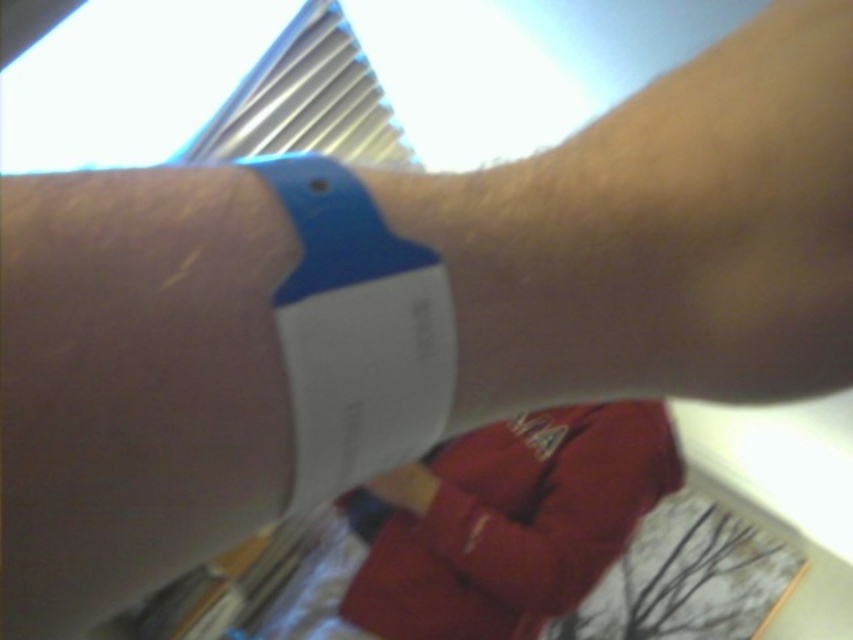
Question: Is white plastic wristband at center wider than matte plastic wristband at center?

Choices:
 (A) yes
 (B) no

Answer: (B)

Question: Does matte red jacket at center appear on the left side of matte plastic wristband at center?

Choices:
 (A) yes
 (B) no

Answer: (B)

Question: Is matte red jacket at center further to camera compared to blue rubber wristband at center?

Choices:
 (A) yes
 (B) no

Answer: (A)

Question: Among these points, which one is nearest to the camera?

Choices:
 (A) (332, 371)
 (B) (144, 566)
 (C) (532, 413)
 (D) (410, 500)

Answer: (B)

Question: Among these points, which one is farthest from the camera?

Choices:
 (A) (524, 483)
 (B) (323, 342)

Answer: (A)

Question: Considering the real-world distances, which object is farthest from the matte red jacket at center?

Choices:
 (A) white plastic wristband at center
 (B) blue rubber wristband at center

Answer: (A)